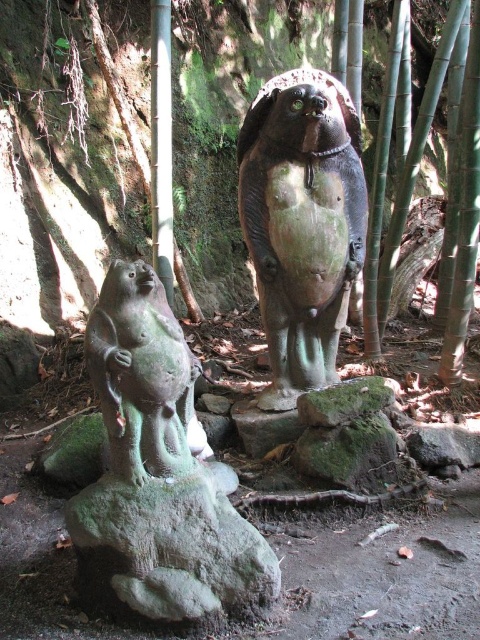
Question: Which object appears farthest from the camera in this image?

Choices:
 (A) green stone statue at center
 (B) green mossy rock at center

Answer: (A)

Question: Can you confirm if green stone monkey at center is smaller than green stone monkey at lower left?

Choices:
 (A) no
 (B) yes

Answer: (A)

Question: Which object appears closest to the camera in this image?

Choices:
 (A) green stone monkey at center
 (B) green stone statue at center
 (C) green stone monkey at lower left

Answer: (A)

Question: Among these objects, which one is farthest from the camera?

Choices:
 (A) green stone statue at center
 (B) green stone monkey at center
 (C) green stone monkey at lower left
 (D) green mossy rock at center

Answer: (A)

Question: Is green stone monkey at lower left closer to camera compared to green mossy rock at center?

Choices:
 (A) no
 (B) yes

Answer: (B)

Question: Is green stone monkey at lower left to the left of green mossy rock at center from the viewer's perspective?

Choices:
 (A) no
 (B) yes

Answer: (B)